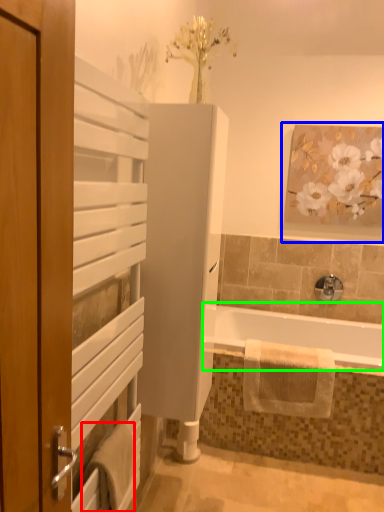
Question: Considering the real-world distances, which object is closest to bath towel (highlighted by a red box)? picture frame (highlighted by a blue box) or bathtub (highlighted by a green box).

Choices:
 (A) picture frame
 (B) bathtub

Answer: (B)